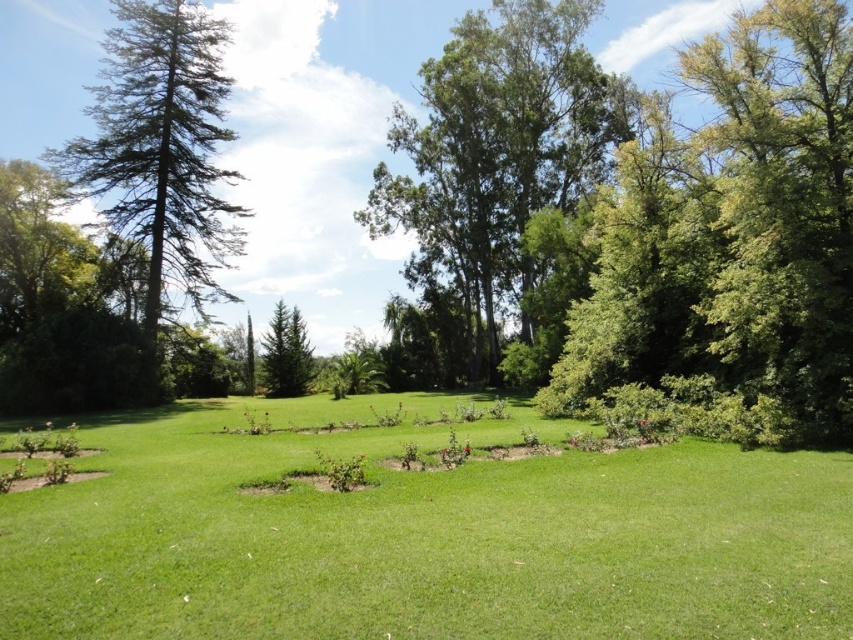
You are standing in the garden and want to take a photo of the green leafy tree at right. However, you notice that the green grassy at center is blocking your view. Is there a way to adjust your position to avoid the grass blocking the tree?

Since the green grassy at center is in front of the green leafy tree at right, you can move to the side so that the grass is no longer between you and the tree, allowing you to capture the tree without obstruction.